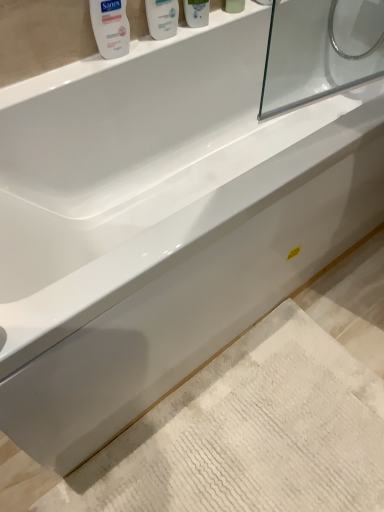
In order to face white glossy bottle at upper center, the 3th mouthwash when ordered from left to right, should I rotate leftwards or rightwards?

Turn right by 0.908 degrees to look at white glossy bottle at upper center, the 3th mouthwash when ordered from left to right.

Identify the location of white glossy mouthwash at upper left, the fourth mouthwash from the right. (110, 27).

From the image's perspective, who appears lower, white textured bath mat at lower center or white glossy bottle at upper center, marked as the 2th mouthwash in a right-to-left arrangement?

white textured bath mat at lower center.

Is white textured bath mat at lower center in front of or behind white glossy bottle at upper center, the 3th mouthwash when ordered from left to right, in the image?

In the image, white textured bath mat at lower center appears in front of white glossy bottle at upper center, the 3th mouthwash when ordered from left to right.

Consider the image. Considering the sizes of objects white textured bath mat at lower center and white glossy bottle at upper center, marked as the 2th mouthwash in a right-to-left arrangement, in the image provided, who is taller, white textured bath mat at lower center or white glossy bottle at upper center, marked as the 2th mouthwash in a right-to-left arrangement,?

Answer: white glossy bottle at upper center, marked as the 2th mouthwash in a right-to-left arrangement.

From a real-world perspective, who is located higher, white glossy mouthwash at upper center, which is the 3th mouthwash in right-to-left order, or white glossy mouthwash at upper left, which ranks as the 1th mouthwash in left-to-right order?

white glossy mouthwash at upper center, which is the 3th mouthwash in right-to-left order, from a real-world perspective.

Are white glossy mouthwash at upper center, the 2th mouthwash from the left, and white glossy mouthwash at upper left, the fourth mouthwash from the right, located far from each other?

They are positioned close to each other.

Do you think white glossy mouthwash at upper center, the 2th mouthwash from the left, is within white glossy mouthwash at upper left, the fourth mouthwash from the right, or outside of it?

white glossy mouthwash at upper center, the 2th mouthwash from the left, exists outside the volume of white glossy mouthwash at upper left, the fourth mouthwash from the right.

From the image's perspective, starting from the white glossy mouthwash at upper left, the fourth mouthwash from the right, which mouthwash is the 1st one above? Please provide its 2D coordinates.

[(162, 18)]

Which is more to the right, white glossy bottle at upper center, the 3th mouthwash when ordered from left to right, or white glossy mouthwash at upper center, which is the 3th mouthwash in right-to-left order?

white glossy bottle at upper center, the 3th mouthwash when ordered from left to right.

From a real-world perspective, who is located higher, white glossy bottle at upper center, marked as the 2th mouthwash in a right-to-left arrangement, or white glossy mouthwash at upper center, the 2th mouthwash from the left?

white glossy bottle at upper center, marked as the 2th mouthwash in a right-to-left arrangement, from a real-world perspective.

Does point (190, 3) lie in front of point (149, 2)?

No, (190, 3) is behind (149, 2).

Is white glossy bottle at upper center, the 3th mouthwash when ordered from left to right, positioned with its back to white glossy mouthwash at upper center, which is the 3th mouthwash in right-to-left order?

No, white glossy mouthwash at upper center, which is the 3th mouthwash in right-to-left order, is not at the back of white glossy bottle at upper center, the 3th mouthwash when ordered from left to right.

From a real-world perspective, is green matte mouthwash at upper center, which is the first mouthwash in right-to-left order, under white glossy mouthwash at upper center, which is the 3th mouthwash in right-to-left order?

No, from a real-world perspective, green matte mouthwash at upper center, which is the first mouthwash in right-to-left order, is not under white glossy mouthwash at upper center, which is the 3th mouthwash in right-to-left order.

Does green matte mouthwash at upper center, the 4th mouthwash positioned from the left, have a lesser width compared to white glossy mouthwash at upper center, the 2th mouthwash from the left?

Indeed, green matte mouthwash at upper center, the 4th mouthwash positioned from the left, has a lesser width compared to white glossy mouthwash at upper center, the 2th mouthwash from the left.

Is green matte mouthwash at upper center, the 4th mouthwash positioned from the left, further to the viewer compared to white glossy mouthwash at upper center, the 2th mouthwash from the left?

Yes, green matte mouthwash at upper center, the 4th mouthwash positioned from the left, is behind white glossy mouthwash at upper center, the 2th mouthwash from the left.

Is green matte mouthwash at upper center, which is the first mouthwash in right-to-left order, to the right of white glossy mouthwash at upper center, the 2th mouthwash from the left, from the viewer's perspective?

Yes, green matte mouthwash at upper center, which is the first mouthwash in right-to-left order, is to the right of white glossy mouthwash at upper center, the 2th mouthwash from the left.

From the white textured bath mat at lower center, count 2nd mouthwashs backward and point to it. Please provide its 2D coordinates.

[(162, 18)]

Is white glossy mouthwash at upper center, which is the 3th mouthwash in right-to-left order, oriented towards white textured bath mat at lower center?

No, white glossy mouthwash at upper center, which is the 3th mouthwash in right-to-left order, is not aimed at white textured bath mat at lower center.

Which of these two, white glossy mouthwash at upper center, the 2th mouthwash from the left, or white textured bath mat at lower center, is bigger?

white textured bath mat at lower center is bigger.

Considering their positions, is white glossy mouthwash at upper center, which is the 3th mouthwash in right-to-left order, located in front of or behind white textured bath mat at lower center?

Visually, white glossy mouthwash at upper center, which is the 3th mouthwash in right-to-left order, is located behind white textured bath mat at lower center.

Is green matte mouthwash at upper center, the 4th mouthwash positioned from the left, surrounding white glossy mouthwash at upper left, which ranks as the 1th mouthwash in left-to-right order?

No, white glossy mouthwash at upper left, which ranks as the 1th mouthwash in left-to-right order, is not surrounded by green matte mouthwash at upper center, the 4th mouthwash positioned from the left.

Does point (225, 9) come closer to viewer compared to point (116, 48)?

No, it is behind (116, 48).

From a real-world perspective, which object rests below the other?

white glossy mouthwash at upper left, the fourth mouthwash from the right, is physically lower.

Which is more to the right, white textured bath mat at lower center or green matte mouthwash at upper center, the 4th mouthwash positioned from the left?

Positioned to the right is green matte mouthwash at upper center, the 4th mouthwash positioned from the left.

Is point (288, 305) closer to viewer compared to point (235, 8)?

No, it is behind (235, 8).

Based on the photo, what's the angular difference between white textured bath mat at lower center and green matte mouthwash at upper center, which is the first mouthwash in right-to-left order,'s facing directions?

The angular difference between white textured bath mat at lower center and green matte mouthwash at upper center, which is the first mouthwash in right-to-left order, is 0.799 degrees.

Where is `the 3rd mouthwash behind when counting from the white textured bath mat at lower center`? Image resolution: width=384 pixels, height=512 pixels. the 3rd mouthwash behind when counting from the white textured bath mat at lower center is located at coordinates (196, 13).

At what (x,y) coordinates should I click in order to perform the action: click on mouthwash that is the 1st object located above the white glossy mouthwash at upper left, which ranks as the 1th mouthwash in left-to-right order (from the image's perspective). Please return your answer as a coordinate pair (x, y). This screenshot has height=512, width=384. Looking at the image, I should click on (162, 18).

Looking at this image, from the image, which object appears to be farther from white glossy mouthwash at upper center, the 2th mouthwash from the left, green matte mouthwash at upper center, the 4th mouthwash positioned from the left, or white glossy mouthwash at upper left, which ranks as the 1th mouthwash in left-to-right order?

green matte mouthwash at upper center, the 4th mouthwash positioned from the left.

Considering their positions, is white glossy mouthwash at upper center, which is the 3th mouthwash in right-to-left order, positioned closer to white glossy mouthwash at upper left, the fourth mouthwash from the right, than green matte mouthwash at upper center, the 4th mouthwash positioned from the left?

white glossy mouthwash at upper center, which is the 3th mouthwash in right-to-left order, is closer to white glossy mouthwash at upper left, the fourth mouthwash from the right.

Consider the image. Looking at the image, which one is located closer to white glossy mouthwash at upper left, the fourth mouthwash from the right, white glossy bottle at upper center, marked as the 2th mouthwash in a right-to-left arrangement, or white glossy mouthwash at upper center, the 2th mouthwash from the left?

Based on the image, white glossy mouthwash at upper center, the 2th mouthwash from the left, appears to be nearer to white glossy mouthwash at upper left, the fourth mouthwash from the right.

Looking at the image, which one is located closer to white glossy mouthwash at upper center, which is the 3th mouthwash in right-to-left order, white textured bath mat at lower center or white glossy bottle at upper center, the 3th mouthwash when ordered from left to right?

Based on the image, white glossy bottle at upper center, the 3th mouthwash when ordered from left to right, appears to be nearer to white glossy mouthwash at upper center, which is the 3th mouthwash in right-to-left order.

Which object lies nearer to the anchor point white glossy mouthwash at upper center, which is the 3th mouthwash in right-to-left order, green matte mouthwash at upper center, the 4th mouthwash positioned from the left, or white textured bath mat at lower center?

green matte mouthwash at upper center, the 4th mouthwash positioned from the left, lies closer to white glossy mouthwash at upper center, which is the 3th mouthwash in right-to-left order, than the other object.

Estimate the real-world distances between objects in this image. Which object is closer to white glossy bottle at upper center, the 3th mouthwash when ordered from left to right, green matte mouthwash at upper center, the 4th mouthwash positioned from the left, or white glossy mouthwash at upper center, which is the 3th mouthwash in right-to-left order?

white glossy mouthwash at upper center, which is the 3th mouthwash in right-to-left order, lies closer to white glossy bottle at upper center, the 3th mouthwash when ordered from left to right, than the other object.

Looking at the image, which one is located closer to white textured bath mat at lower center, white glossy mouthwash at upper left, the fourth mouthwash from the right, or white glossy mouthwash at upper center, the 2th mouthwash from the left?

white glossy mouthwash at upper left, the fourth mouthwash from the right.

Estimate the real-world distances between objects in this image. Which object is closer to white textured bath mat at lower center, green matte mouthwash at upper center, which is the first mouthwash in right-to-left order, or white glossy mouthwash at upper left, the fourth mouthwash from the right?

Based on the image, white glossy mouthwash at upper left, the fourth mouthwash from the right, appears to be nearer to white textured bath mat at lower center.

Locate an element on the screen. This screenshot has height=512, width=384. mouthwash between white glossy mouthwash at upper center, the 2th mouthwash from the left, and green matte mouthwash at upper center, the 4th mouthwash positioned from the left, in the horizontal direction is located at coordinates (196, 13).

What are the coordinates of `mouthwash between white glossy mouthwash at upper center, which is the 3th mouthwash in right-to-left order, and white textured bath mat at lower center from top to bottom` in the screenshot? It's located at (110, 27).

Locate an element on the screen. This screenshot has width=384, height=512. mouthwash between white glossy mouthwash at upper left, which ranks as the 1th mouthwash in left-to-right order, and white glossy bottle at upper center, the 3th mouthwash when ordered from left to right, in the horizontal direction is located at coordinates (162, 18).